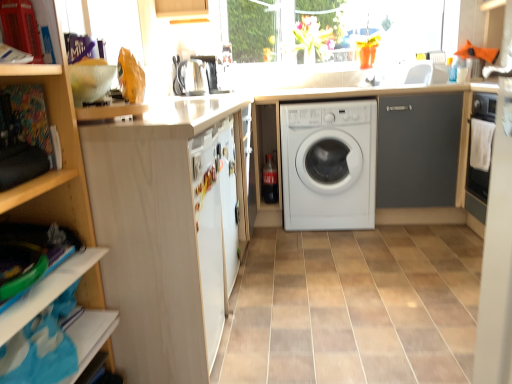
This screenshot has width=512, height=384. What do you see at coordinates (228, 200) in the screenshot?
I see `white matte refrigerator at center` at bounding box center [228, 200].

In order to face satin silver coffee machine at upper center, should I rotate leftwards or rightwards?

Rotate left and turn 6.439 degrees.

Locate an element on the screen. white wood cabinet at left, which is the second cabinetry from right to left is located at coordinates (168, 231).

Find the location of a particular element. The height and width of the screenshot is (384, 512). white glossy sink at upper right is located at coordinates (407, 74).

From the image's perspective, does satin silver coffee machine at upper center appear higher than dark gray matte cabinet at center-right, acting as the second cabinetry starting from the left?

Yes, from the image's perspective, satin silver coffee machine at upper center is above dark gray matte cabinet at center-right, acting as the second cabinetry starting from the left.

How many degrees apart are the facing directions of satin silver coffee machine at upper center and dark gray matte cabinet at center-right, the second cabinetry positioned from the front?

The facing directions of satin silver coffee machine at upper center and dark gray matte cabinet at center-right, the second cabinetry positioned from the front, are 89 degrees apart.

Is satin silver coffee machine at upper center oriented towards dark gray matte cabinet at center-right, arranged as the 1th cabinetry when viewed from the right?

Yes, satin silver coffee machine at upper center is aimed at dark gray matte cabinet at center-right, arranged as the 1th cabinetry when viewed from the right.

Are white glossy sink at upper right and white wood cabinet at left, arranged as the 1th cabinetry when viewed from the front, making contact?

white glossy sink at upper right and white wood cabinet at left, arranged as the 1th cabinetry when viewed from the front, are clearly separated.

Would you say white glossy sink at upper right is to the left or to the right of white wood cabinet at left, which is the second cabinetry from right to left, in the picture?

From the image, it's evident that white glossy sink at upper right is to the right of white wood cabinet at left, which is the second cabinetry from right to left.

Is point (379, 69) closer or farther from the camera than point (152, 381)?

Point (379, 69) appears to be farther away from the viewer than point (152, 381).

Does white glossy sink at upper right have a larger size compared to white wood cabinet at left, the 2th cabinetry when ordered from back to front?

No.

Which object is closer to the camera taking this photo, white wood cabinet at left, arranged as the 1th cabinetry when viewed from the front, or translucent glass window at upper center?

Positioned in front is white wood cabinet at left, arranged as the 1th cabinetry when viewed from the front.

Where is `window screen located on the right of white wood cabinet at left, the 2th cabinetry when ordered from back to front`? The image size is (512, 384). window screen located on the right of white wood cabinet at left, the 2th cabinetry when ordered from back to front is located at coordinates [x=387, y=23].

From the image's perspective, who appears lower, white wood cabinet at left, which is the first cabinetry in left-to-right order, or translucent glass window at upper center?

white wood cabinet at left, which is the first cabinetry in left-to-right order, from the image's perspective.

Based on the photo, which object is thinner, white wood cabinet at left, the 2th cabinetry when ordered from back to front, or translucent glass window at upper center?

Thinner between the two is translucent glass window at upper center.

In the scene shown: Would you consider white matte washing machine at center to be distant from satin silver coffee machine at upper center?

Yes, white matte washing machine at center and satin silver coffee machine at upper center are located far from each other.

From the image's perspective, would you say white matte washing machine at center is positioned over satin silver coffee machine at upper center?

Incorrect, from the image's perspective, white matte washing machine at center is lower than satin silver coffee machine at upper center.

Consider the image. Is white matte washing machine at center positioned before satin silver coffee machine at upper center?

Yes, white matte washing machine at center is closer to the camera.

From a real-world perspective, is satin silver kettle at upper center physically above white matte refrigerator at center?

Yes.

How many degrees apart are the facing directions of satin silver kettle at upper center and white matte refrigerator at center?

They differ by 0.000865 degrees in their facing directions.

Is satin silver kettle at upper center looking in the opposite direction of white matte refrigerator at center?

No, satin silver kettle at upper center is not facing the opposite direction of white matte refrigerator at center.

Between satin silver kettle at upper center and white matte refrigerator at center, which one has larger width?

Wider between the two is satin silver kettle at upper center.

Is satin silver coffee machine at upper center inside or outside of satin silver kettle at upper center?

satin silver coffee machine at upper center is spatially situated outside satin silver kettle at upper center.

Between satin silver coffee machine at upper center and satin silver kettle at upper center, which one is positioned in front?

satin silver kettle at upper center is in front.

Is satin silver coffee machine at upper center wider or thinner than satin silver kettle at upper center?

satin silver coffee machine at upper center is wider than satin silver kettle at upper center.

I want to click on appliance located below the satin silver coffee machine at upper center (from the image's perspective), so click(192, 77).

From the image's perspective, is wooden shelf at upper left beneath white matte refrigerator at center?

No, from the image's perspective, wooden shelf at upper left is not beneath white matte refrigerator at center.

Which object is positioned more to the left, wooden shelf at upper left or white matte refrigerator at center?

From the viewer's perspective, wooden shelf at upper left appears more on the left side.

Is white matte refrigerator at center completely or partially inside wooden shelf at upper left?

No, wooden shelf at upper left does not contain white matte refrigerator at center.

From a real-world perspective, which is physically above, wooden shelf at upper left or white matte refrigerator at center?

wooden shelf at upper left.

Where is `coffee machine behind the dark gray matte cabinet at center-right, arranged as the 1th cabinetry when viewed from the right`? coffee machine behind the dark gray matte cabinet at center-right, arranged as the 1th cabinetry when viewed from the right is located at coordinates (210, 72).

In the image, there is a white wood cabinet at left, which is the first cabinetry in left-to-right order. Where is `sink above it (from the image's perspective)`? sink above it (from the image's perspective) is located at coordinates (407, 74).

Estimate the real-world distances between objects in this image. Which object is further from wooden shelf at upper left, white matte refrigerator at center or dark gray matte cabinet at center-right, which is counted as the first cabinetry, starting from the back?

dark gray matte cabinet at center-right, which is counted as the first cabinetry, starting from the back, is positioned further to the anchor wooden shelf at upper left.

When comparing their distances from translucent glass window at upper center, does white wood cabinet at left, which is the first cabinetry in left-to-right order, or white matte washing machine at center seem further?

Among the two, white wood cabinet at left, which is the first cabinetry in left-to-right order, is located further to translucent glass window at upper center.

From the image, which object appears to be nearer to brown ceramic tile at center, white glossy sink at upper right or white matte refrigerator at center?

white matte refrigerator at center is positioned closer to the anchor brown ceramic tile at center.

Which object lies further to the anchor point translucent glass window at upper center, white wood cabinet at left, the 2th cabinetry when ordered from back to front, or satin silver kettle at upper center?

The object further to translucent glass window at upper center is white wood cabinet at left, the 2th cabinetry when ordered from back to front.

When comparing their distances from satin silver coffee machine at upper center, does white glossy sink at upper right or white wood cabinet at left, arranged as the 1th cabinetry when viewed from the front, seem closer?

Based on the image, white glossy sink at upper right appears to be nearer to satin silver coffee machine at upper center.

Looking at the image, which one is located closer to satin silver coffee machine at upper center, dark gray matte cabinet at center-right, the second cabinetry positioned from the front, or white wood cabinet at left, which is the second cabinetry from right to left?

dark gray matte cabinet at center-right, the second cabinetry positioned from the front, lies closer to satin silver coffee machine at upper center than the other object.

Considering their positions, is white wood cabinet at left, the 2th cabinetry when ordered from back to front, positioned closer to dark gray matte cabinet at center-right, the second cabinetry positioned from the front, than white matte washing machine at center?

The object closer to dark gray matte cabinet at center-right, the second cabinetry positioned from the front, is white matte washing machine at center.

Looking at the image, which one is located closer to brown ceramic tile at center, white glossy sink at upper right or satin silver coffee machine at upper center?

white glossy sink at upper right is positioned closer to the anchor brown ceramic tile at center.

Identify the location of screen door between satin silver kettle at upper center and dark gray matte cabinet at center-right, the second cabinetry positioned from the front, in the horizontal direction. The image size is (512, 384). (228, 200).

The image size is (512, 384). Find the location of `cabinetry positioned between brown ceramic tile at center and white matte washing machine at center from near to far`. cabinetry positioned between brown ceramic tile at center and white matte washing machine at center from near to far is located at coordinates (418, 150).

Where is `washing machine positioned between white wood cabinet at left, which is the first cabinetry in left-to-right order, and satin silver kettle at upper center from near to far`? washing machine positioned between white wood cabinet at left, which is the first cabinetry in left-to-right order, and satin silver kettle at upper center from near to far is located at coordinates (329, 164).

Locate an element on the screen. ceramic tile between white wood cabinet at left, which is the second cabinetry from right to left, and translucent glass window at upper center from front to back is located at coordinates (354, 307).